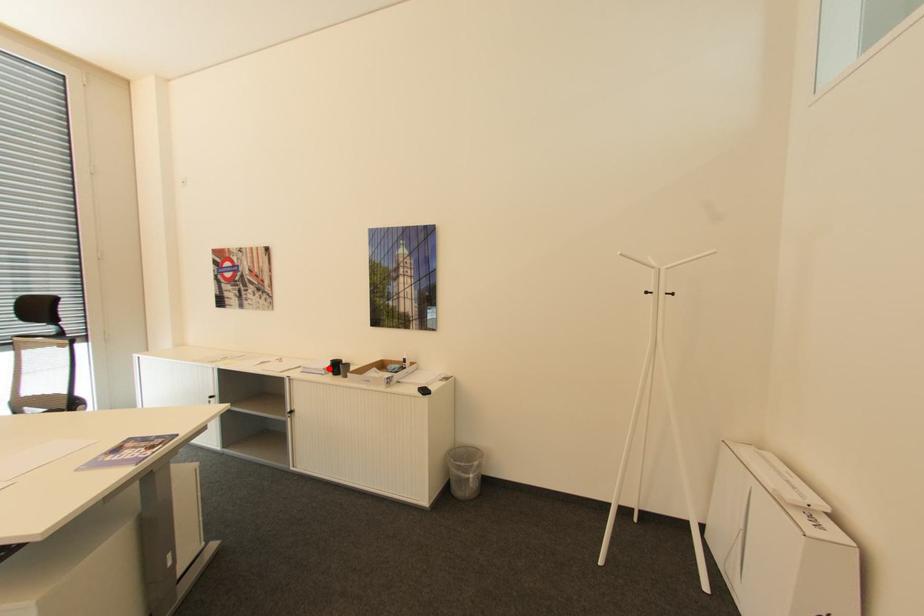
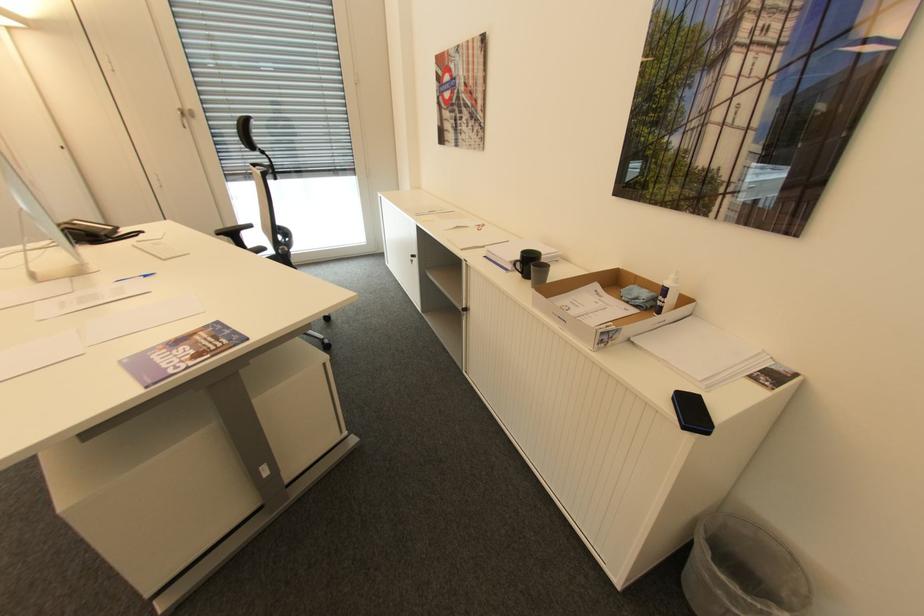
Question: I am providing you with two images of the same scene from different viewpoints. Image1 has a red point marked. In image2, the corresponding 3D location appears at what relative position? Reply with the corresponding letter.

Choices:
 (A) Closer
 (B) Farther

Answer: (A)